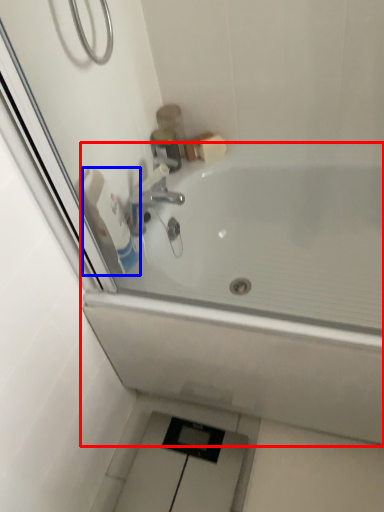
Question: Among these objects, which one is farthest to the camera, bathtub (highlighted by a red box) or toilet paper (highlighted by a blue box)?

Choices:
 (A) bathtub
 (B) toilet paper

Answer: (B)